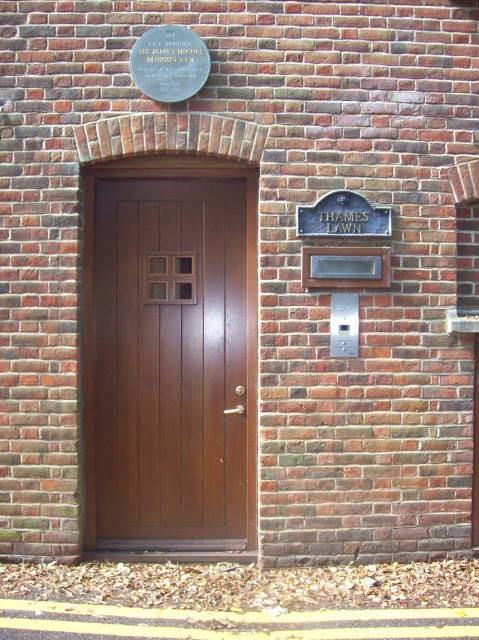
Question: Which point appears closest to the camera in this image?

Choices:
 (A) (387, 212)
 (B) (221, 474)

Answer: (A)

Question: In this image, where is bronze plaque at upper center located relative to black metal sign at upper right?

Choices:
 (A) right
 (B) left

Answer: (B)

Question: Does bronze plaque at upper center appear on the right side of black metal sign at upper right?

Choices:
 (A) yes
 (B) no

Answer: (B)

Question: Among these objects, which one is farthest from the camera?

Choices:
 (A) black metal sign at upper right
 (B) bronze plaque at upper center
 (C) brown wooden door at center

Answer: (C)

Question: Which object is farther from the camera taking this photo?

Choices:
 (A) brown wooden door at center
 (B) bronze plaque at upper center

Answer: (A)

Question: Does bronze plaque at upper center appear on the right side of black metal sign at upper right?

Choices:
 (A) no
 (B) yes

Answer: (A)